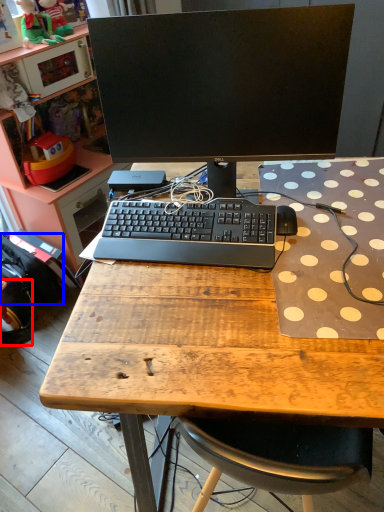
Question: Which point is further to the camera, backpack (highlighted by a red box) or backpack (highlighted by a blue box)?

Choices:
 (A) backpack
 (B) backpack

Answer: (B)